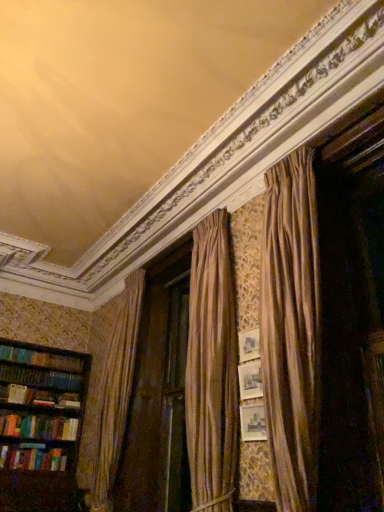
Question: Is wooden bookshelf at left touching multicolored hardcover books at left?

Choices:
 (A) yes
 (B) no

Answer: (B)

Question: From a real-world perspective, is wooden bookshelf at left on top of multicolored hardcover books at left?

Choices:
 (A) no
 (B) yes

Answer: (B)

Question: Is wooden bookshelf at left aimed at multicolored hardcover books at left?

Choices:
 (A) yes
 (B) no

Answer: (A)

Question: Is wooden bookshelf at left to the left of multicolored hardcover books at left from the viewer's perspective?

Choices:
 (A) no
 (B) yes

Answer: (A)

Question: Is wooden bookshelf at left further to the viewer compared to multicolored hardcover books at left?

Choices:
 (A) yes
 (B) no

Answer: (B)

Question: From the image's perspective, would you say wooden bookshelf at left is shown under multicolored hardcover books at left?

Choices:
 (A) no
 (B) yes

Answer: (A)

Question: Is multicolored hardcover books at left taller than wooden bookshelf at left?

Choices:
 (A) no
 (B) yes

Answer: (A)

Question: From the image's perspective, is multicolored hardcover books at left below wooden bookshelf at left?

Choices:
 (A) yes
 (B) no

Answer: (A)

Question: Is multicolored hardcover books at left placed right next to wooden bookshelf at left?

Choices:
 (A) no
 (B) yes

Answer: (A)

Question: Does multicolored hardcover books at left turn towards wooden bookshelf at left?

Choices:
 (A) no
 (B) yes

Answer: (B)

Question: Is multicolored hardcover books at left shorter than wooden bookshelf at left?

Choices:
 (A) yes
 (B) no

Answer: (A)

Question: From the image's perspective, would you say multicolored hardcover books at left is positioned over wooden bookshelf at left?

Choices:
 (A) no
 (B) yes

Answer: (A)

Question: From their relative heights in the image, would you say multicolored hardcover books at left is taller or shorter than wooden bookshelf at left?

Choices:
 (A) tall
 (B) short

Answer: (B)